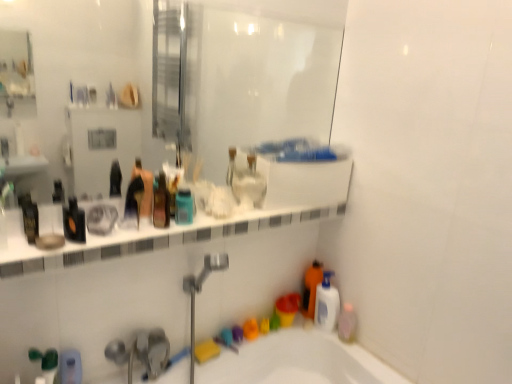
Question: Do you think black glossy bottle at left, positioned as the 5th mouthwash in right-to-left order, is within white glossy ledge at upper center, or outside of it?

Choices:
 (A) outside
 (B) inside

Answer: (A)

Question: From the image's perspective, is black glossy bottle at left, the 1th mouthwash viewed from the left, located above or below white glossy ledge at upper center?

Choices:
 (A) below
 (B) above

Answer: (B)

Question: Which object is the farthest from the white glossy ledge at upper center?

Choices:
 (A) matte black bottle at center, marked as the second toiletry in a right-to-left arrangement
 (B) translucent plastic mouthwash at center, which is the fourth mouthwash from right to left
 (C) pink translucent bottle at lower right, acting as the 5th mouthwash starting from the left
 (D) translucent plastic bottle at lower right
 (E) transparent glass mirror at upper center

Answer: (E)

Question: Which object is positioned farthest from the black glossy bottle at left, the 1th mouthwash viewed from the left?

Choices:
 (A) white glossy ledge at upper center
 (B) translucent plastic bottle at lower right
 (C) matte black bottle at center, marked as the second toiletry in a right-to-left arrangement
 (D) translucent plastic mouthwash at center, which appears as the 2th mouthwash when viewed from the front
 (E) teal plastic mouthwash at center, the third mouthwash from the left

Answer: (B)